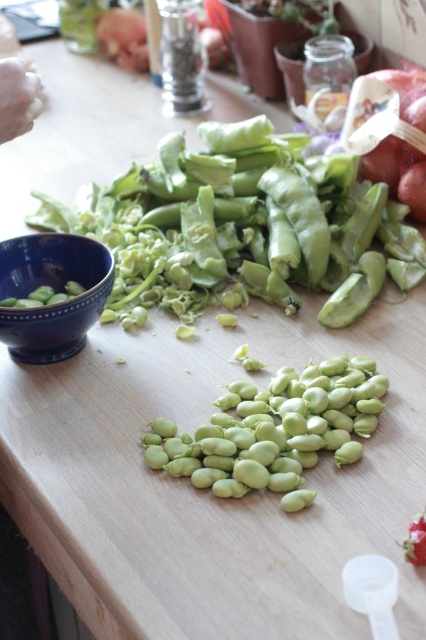
Question: Does green matte pod at center appear under green matte fava beans at center?

Choices:
 (A) no
 (B) yes

Answer: (A)

Question: Where is green matte fava beans at center located in relation to white flesh hand at upper left in the image?

Choices:
 (A) below
 (B) above

Answer: (A)

Question: Can you confirm if green matte pod at center is bigger than green matte fava beans at center?

Choices:
 (A) no
 (B) yes

Answer: (B)

Question: Which point is farther to the camera?

Choices:
 (A) white flesh hand at upper left
 (B) green matte pod at center

Answer: (B)

Question: Which object appears closest to the camera in this image?

Choices:
 (A) green matte pod at center
 (B) white flesh hand at upper left

Answer: (B)

Question: Which object appears closest to the camera in this image?

Choices:
 (A) green matte fava beans at center
 (B) white flesh hand at upper left
 (C) green matte pod at center

Answer: (A)